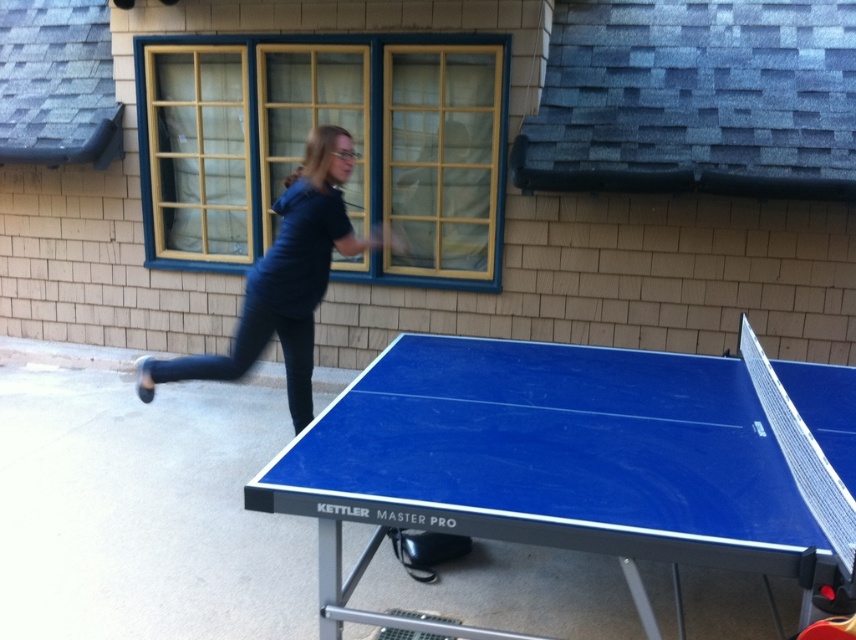
Can you confirm if blue glossy table tennis table at center is taller than dark blue fabric at upper center?

In fact, blue glossy table tennis table at center may be shorter than dark blue fabric at upper center.

Can you confirm if blue glossy table tennis table at center is positioned below dark blue fabric at upper center?

Correct, blue glossy table tennis table at center is located below dark blue fabric at upper center.

Between point (672, 477) and point (209, 380), which one is positioned in front?

Point (672, 477)

Find the location of a particular element. The image size is (856, 640). blue glossy table tennis table at center is located at coordinates (580, 458).